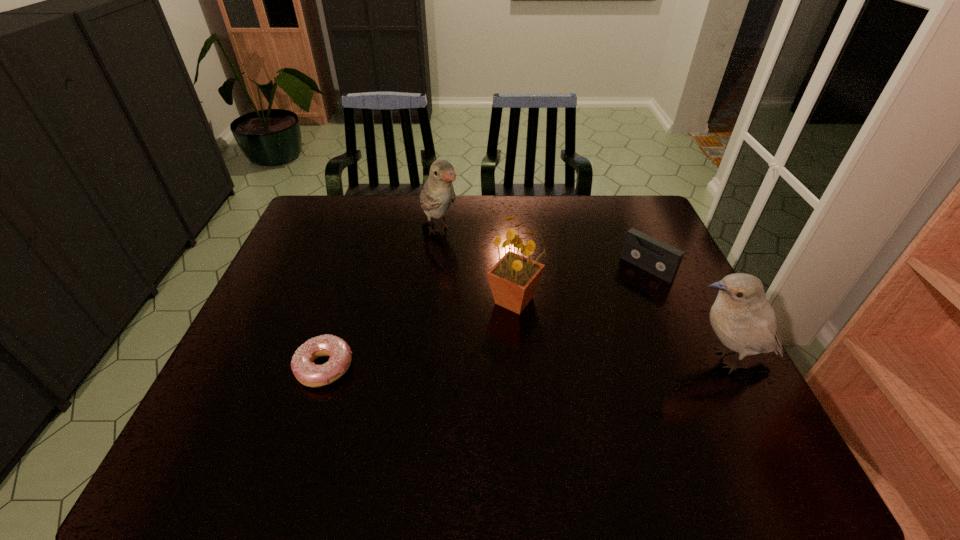
At what (x,y) coordinates should I click in order to perform the action: click on vacant space at the far left corner of the desktop. Please return your answer as a coordinate pair (x, y). Looking at the image, I should click on (314, 224).

You are a GUI agent. You are given a task and a screenshot of the screen. Output one action in this format:
    pyautogui.click(x=<x>, y=<y>)
    Task: Click on the vacant space at the near left corner of the desktop
    This screenshot has width=960, height=540.
    Given the screenshot: What is the action you would take?
    pyautogui.click(x=219, y=408)

In the image, there is a desktop. What are the coordinates of `vacant space at the far right corner` in the screenshot? It's located at (621, 204).

Locate an element on the screen. The width and height of the screenshot is (960, 540). vacant region between the doughnut and the third object from right to left is located at coordinates (420, 334).

Identify the location of vacant space that's between the shortest object and the farther bird. (382, 299).

Image resolution: width=960 pixels, height=540 pixels. Identify the location of vacant space that's between the second shortest object and the leftmost object. (486, 318).

The width and height of the screenshot is (960, 540). Identify the location of empty location between the right bird and the farther bird. (582, 295).

Find the location of a particular element. The image size is (960, 540). empty space between the farthest object and the right bird is located at coordinates (582, 295).

The height and width of the screenshot is (540, 960). In order to click on empty location between the third object from right to left and the shortest object in this screenshot , I will do `click(420, 334)`.

This screenshot has width=960, height=540. I want to click on free space between the sunflower and the nearer bird, so (x=619, y=330).